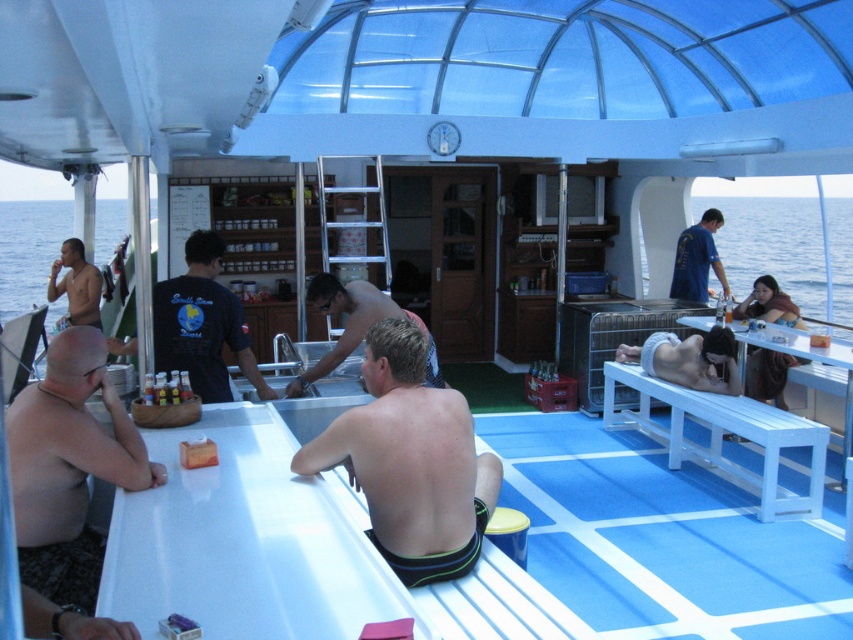
Question: Can you confirm if bald head at left is bigger than blue water at left?

Choices:
 (A) yes
 (B) no

Answer: (B)

Question: Can you confirm if shiny black swim trunks at center is positioned above translucent plastic bottle at bar?

Choices:
 (A) yes
 (B) no

Answer: (A)

Question: Which of the following is the closest to the observer?

Choices:
 (A) (20, 284)
 (B) (91, 472)

Answer: (B)

Question: Estimate the real-world distances between objects in this image. Which object is closer to the blue water at left?

Choices:
 (A) shiny metallic sink at center
 (B) blue fabric shirt at upper right
 (C) dark blue shirt at center

Answer: (C)

Question: Can you confirm if shiny black swim trunks at center is positioned to the right of shiny metallic sink at center?

Choices:
 (A) no
 (B) yes

Answer: (B)

Question: Among these points, which one is nearest to the camera?

Choices:
 (A) (358, 292)
 (B) (119, 456)

Answer: (B)